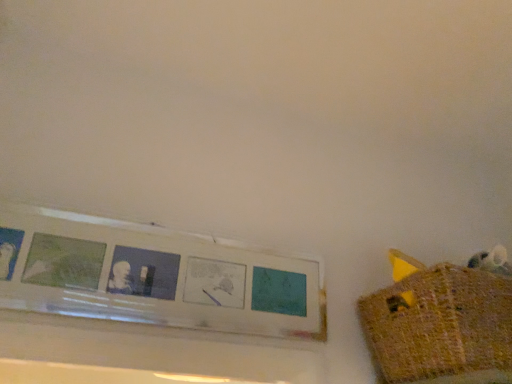
Question: Is knitted yellow basket at right taller or shorter than white matte picture frame at upper left?

Choices:
 (A) tall
 (B) short

Answer: (B)

Question: Would you say knitted yellow basket at right is to the left or to the right of white matte picture frame at upper left in the picture?

Choices:
 (A) right
 (B) left

Answer: (A)

Question: Considering their positions, is knitted yellow basket at right located in front of or behind white matte picture frame at upper left?

Choices:
 (A) front
 (B) behind

Answer: (A)

Question: From the image's perspective, is white matte picture frame at upper left above or below knitted yellow basket at right?

Choices:
 (A) above
 (B) below

Answer: (A)

Question: In the image, is white matte picture frame at upper left positioned in front of or behind knitted yellow basket at right?

Choices:
 (A) front
 (B) behind

Answer: (B)

Question: Looking at the image, does white matte picture frame at upper left seem bigger or smaller compared to knitted yellow basket at right?

Choices:
 (A) small
 (B) big

Answer: (A)

Question: Would you say white matte picture frame at upper left is to the left or to the right of knitted yellow basket at right in the picture?

Choices:
 (A) left
 (B) right

Answer: (A)